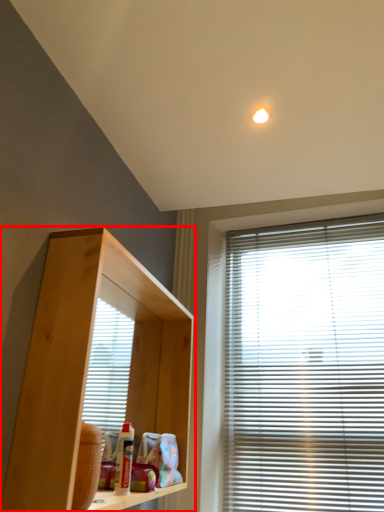
Question: From the image, what is the correct spatial relationship of shelf (annotated by the red box) in relation to window blind?

Choices:
 (A) right
 (B) left

Answer: (B)